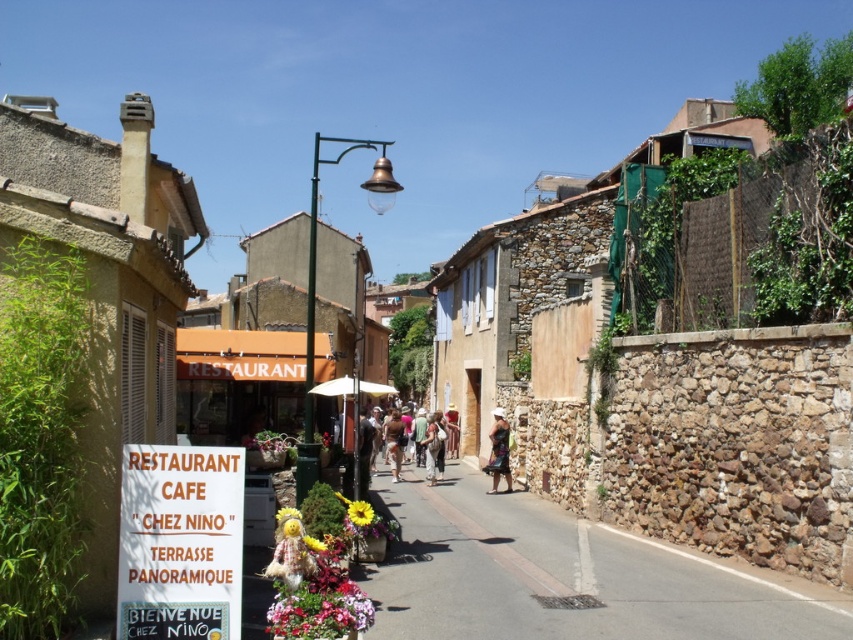
Consider the image. Can you confirm if smooth stone wall at center is positioned below orange fabric restaurant at center?

Indeed, smooth stone wall at center is positioned under orange fabric restaurant at center.

Identify the location of smooth stone wall at center. (567, 577).

Where is `smooth stone wall at center`? The image size is (853, 640). smooth stone wall at center is located at coordinates (567, 577).

At what (x,y) coordinates should I click in order to perform the action: click on smooth stone wall at center. Please return your answer as a coordinate pair (x, y). The width and height of the screenshot is (853, 640). Looking at the image, I should click on (567, 577).

Is white paper sign at center to the right of brown fabric bag at center from the viewer's perspective?

Result: In fact, white paper sign at center is to the left of brown fabric bag at center.

Which is in front, point (146, 627) or point (393, 408)?

Positioned in front is point (146, 627).

Image resolution: width=853 pixels, height=640 pixels. I want to click on white paper sign at center, so click(x=180, y=541).

Who is more distant from viewer, (498, 408) or (399, 417)?

Point (399, 417)

Where is `multicolored woven bag at center`? This screenshot has width=853, height=640. multicolored woven bag at center is located at coordinates tap(498, 451).

Find the location of `multicolored woven bag at center`. multicolored woven bag at center is located at coordinates (498, 451).